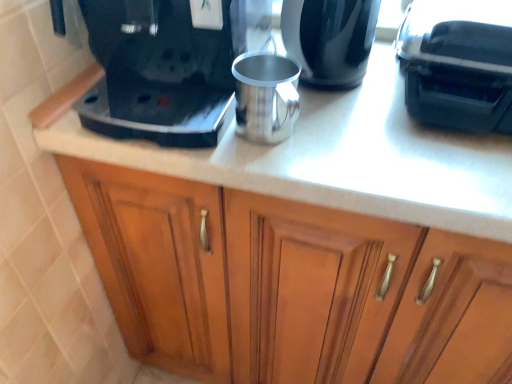
Question: Is shiny black kettle at upper center not near black plastic coffee maker at upper left?

Choices:
 (A) no
 (B) yes

Answer: (A)

Question: Is black plastic coffee maker at upper left at the back of shiny black kettle at upper center?

Choices:
 (A) yes
 (B) no

Answer: (B)

Question: Is shiny black kettle at upper center oriented towards black plastic coffee maker at upper left?

Choices:
 (A) no
 (B) yes

Answer: (A)

Question: From the image's perspective, does shiny black kettle at upper center appear lower than black plastic coffee maker at upper left?

Choices:
 (A) no
 (B) yes

Answer: (B)

Question: Can we say shiny black kettle at upper center lies outside black plastic coffee maker at upper left?

Choices:
 (A) no
 (B) yes

Answer: (B)

Question: Considering the positions of black plastic coffee maker at upper left and wooden cabinet at center in the image, is black plastic coffee maker at upper left taller or shorter than wooden cabinet at center?

Choices:
 (A) short
 (B) tall

Answer: (A)

Question: From the image's perspective, is black plastic coffee maker at upper left above or below wooden cabinet at center?

Choices:
 (A) above
 (B) below

Answer: (A)

Question: Considering their positions, is black plastic coffee maker at upper left located in front of or behind wooden cabinet at center?

Choices:
 (A) front
 (B) behind

Answer: (B)

Question: Is point (172, 41) closer or farther from the camera than point (174, 304)?

Choices:
 (A) farther
 (B) closer

Answer: (B)

Question: In terms of size, does shiny black kettle at upper center appear bigger or smaller than black plastic coffee machine at upper right?

Choices:
 (A) big
 (B) small

Answer: (B)

Question: From the image's perspective, relative to black plastic coffee machine at upper right, is shiny black kettle at upper center above or below?

Choices:
 (A) above
 (B) below

Answer: (A)

Question: Relative to black plastic coffee machine at upper right, is shiny black kettle at upper center in front or behind?

Choices:
 (A) behind
 (B) front

Answer: (A)

Question: Considering the positions of shiny black kettle at upper center and black plastic coffee machine at upper right in the image, is shiny black kettle at upper center taller or shorter than black plastic coffee machine at upper right?

Choices:
 (A) short
 (B) tall

Answer: (B)

Question: Based on their sizes in the image, would you say shiny black kettle at upper center is bigger or smaller than black plastic coffee maker at upper left?

Choices:
 (A) small
 (B) big

Answer: (A)

Question: In terms of height, does shiny black kettle at upper center look taller or shorter compared to black plastic coffee maker at upper left?

Choices:
 (A) tall
 (B) short

Answer: (B)